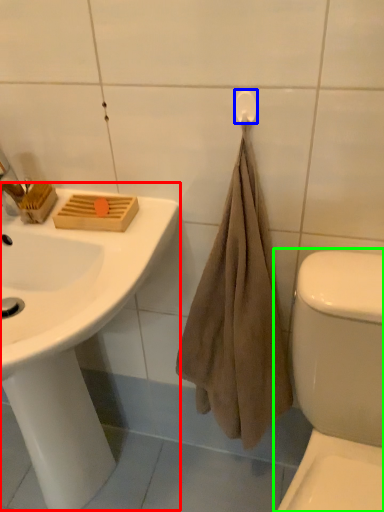
Question: Which object is the farthest from sink (highlighted by a red box)? Choose among these: towel bar (highlighted by a blue box) or toilet (highlighted by a green box).

Choices:
 (A) towel bar
 (B) toilet

Answer: (A)